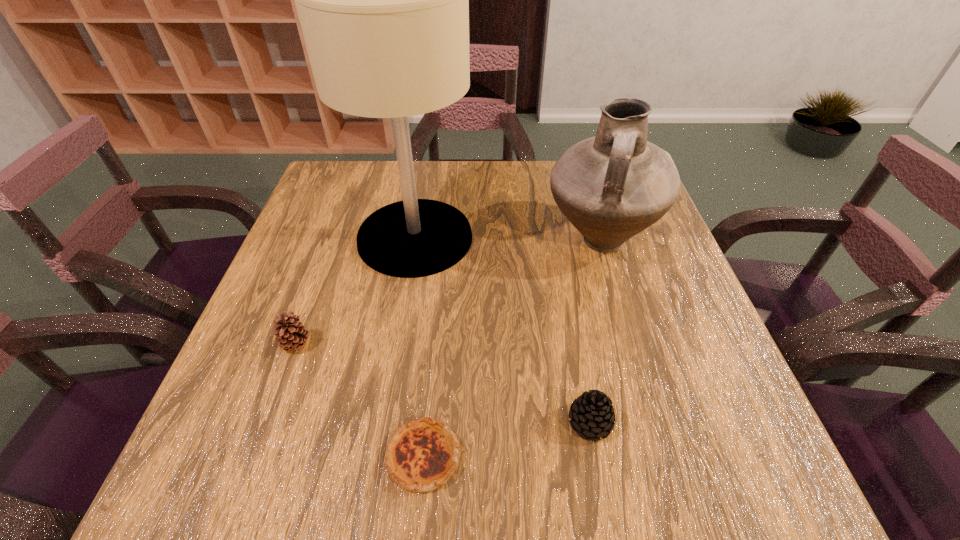
This screenshot has width=960, height=540. Identify the location of vacant space that's between the right pinecone and the farther pinecone. (444, 383).

You are a GUI agent. You are given a task and a screenshot of the screen. Output one action in this format:
    pyautogui.click(x=<x>, y=<y>)
    Task: Click on the empty location between the table lamp and the right pinecone
    This screenshot has width=960, height=540.
    Given the screenshot: What is the action you would take?
    pyautogui.click(x=502, y=330)

The image size is (960, 540). What are the coordinates of `vacant point located between the left pinecone and the second tallest object` in the screenshot? It's located at (447, 293).

At what (x,y) coordinates should I click in order to perform the action: click on unoccupied position between the right pinecone and the tallest object. Please return your answer as a coordinate pair (x, y). This screenshot has height=540, width=960. Looking at the image, I should click on (502, 330).

Where is `object that is the second closest to the tallest object`? The image size is (960, 540). object that is the second closest to the tallest object is located at coordinates (611, 187).

Choose which object is the nearest neighbor to the leftmost object. Please provide its 2D coordinates. Your answer should be formatted as a tuple, i.e. [(x, y)], where the tuple contains the x and y coordinates of a point satisfying the conditions above.

[(383, 0)]